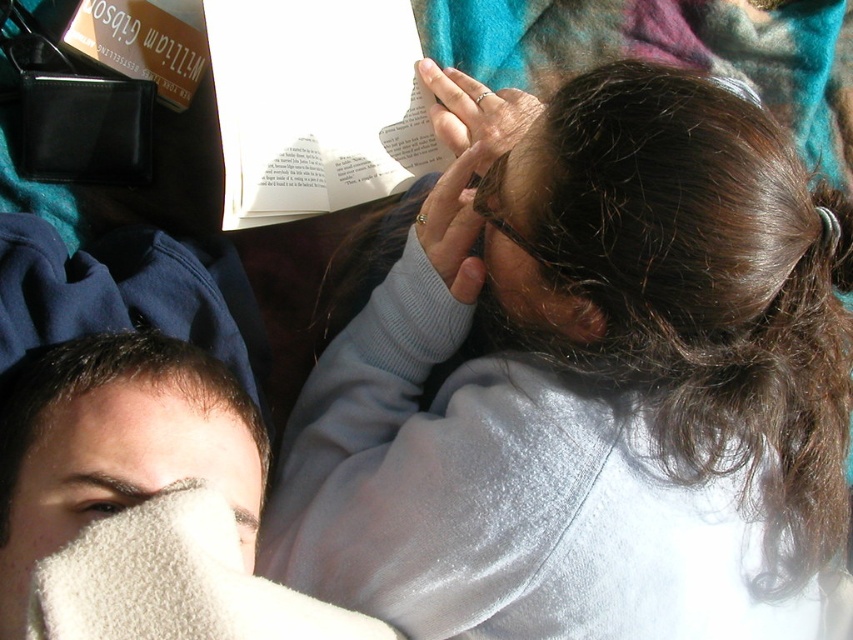
From the picture: Can you confirm if hardcover book at upper left is thinner than dry skin at upper left?

Indeed, hardcover book at upper left has a lesser width compared to dry skin at upper left.

Is hardcover book at upper left positioned at the back of dry skin at upper left?

Yes, it is behind dry skin at upper left.

Is point (123, 13) closer to camera compared to point (253, 419)?

No, (123, 13) is further to viewer.

I want to click on hardcover book at upper left, so click(143, 42).

Who is more forward, (329, 74) or (534, 108)?

Point (534, 108) is more forward.

Is point (254, 182) behind point (480, 141)?

Yes, point (254, 182) is behind point (480, 141).

Who is more forward, (410, 19) or (480, 173)?

Point (480, 173) is in front.

I want to click on white paper at upper center, so click(x=316, y=106).

Can you confirm if white paper at upper center is positioned above hardcover book at upper left?

Incorrect, white paper at upper center is not positioned above hardcover book at upper left.

Does white paper at upper center lie behind hardcover book at upper left?

That is False.

This screenshot has width=853, height=640. What do you see at coordinates (316, 106) in the screenshot? I see `white paper at upper center` at bounding box center [316, 106].

Where is `white paper at upper center`? The image size is (853, 640). white paper at upper center is located at coordinates (316, 106).